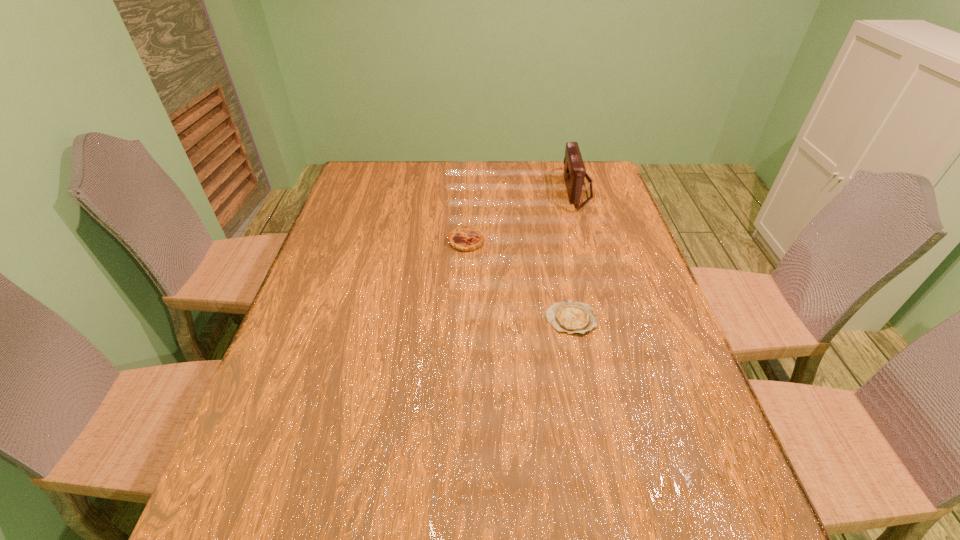
Find the location of a particular element. blank area located 0.180m on the back of the right quiche is located at coordinates (559, 257).

Image resolution: width=960 pixels, height=540 pixels. Identify the location of object that is at the far edge. (574, 172).

Locate an element on the screen. Image resolution: width=960 pixels, height=540 pixels. object located in the right edge section of the desktop is located at coordinates (574, 172).

This screenshot has height=540, width=960. Identify the location of object positioned at the far right corner. (574, 172).

Image resolution: width=960 pixels, height=540 pixels. In the image, there is a desktop. Find the location of `vacant space at the far edge`. vacant space at the far edge is located at coordinates (427, 166).

Locate an element on the screen. This screenshot has width=960, height=540. free space at the left edge is located at coordinates (354, 241).

Find the location of a particular element. vacant area at the right edge of the desktop is located at coordinates (614, 300).

At what (x,y) coordinates should I click in order to perform the action: click on free space at the far right corner. Please return your answer as a coordinate pair (x, y). Looking at the image, I should click on (594, 183).

This screenshot has width=960, height=540. What are the coordinates of `blank region between the farthest object and the second object from right to left` in the screenshot? It's located at click(574, 254).

You are a GUI agent. You are given a task and a screenshot of the screen. Output one action in this format:
    pyautogui.click(x=<x>, y=<y>)
    Task: Click on the vacant space that is in between the farthest object and the right quiche
    The width and height of the screenshot is (960, 540).
    Given the screenshot: What is the action you would take?
    pyautogui.click(x=574, y=254)